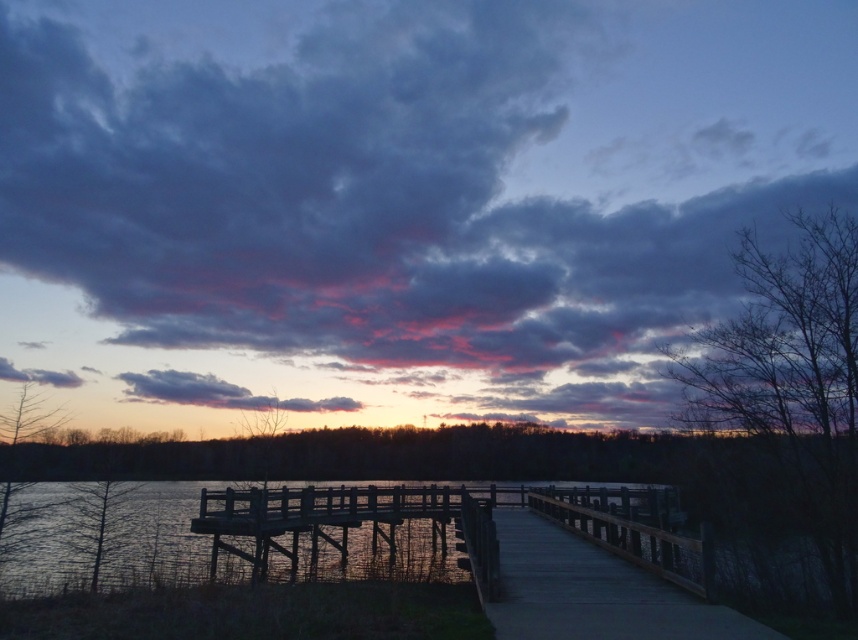
Question: Does purple matte cloud at upper center have a greater width compared to wooden dock at center?

Choices:
 (A) no
 (B) yes

Answer: (B)

Question: Which is farther from the dark wood water at lower left?

Choices:
 (A) smooth concrete walkway at center
 (B) purple matte cloud at upper center

Answer: (B)

Question: Which point is farther from the camera taking this photo?

Choices:
 (A) (310, 513)
 (B) (210, 518)
 (C) (53, 104)

Answer: (C)

Question: Can you confirm if smooth concrete walkway at center is positioned above wooden dock at center?

Choices:
 (A) no
 (B) yes

Answer: (B)

Question: Which of the following is the closest to the observer?

Choices:
 (A) dark wood water at lower left
 (B) smooth concrete walkway at center

Answer: (B)

Question: Where is purple matte cloud at upper center located in relation to wooden dock at center in the image?

Choices:
 (A) left
 (B) right

Answer: (B)